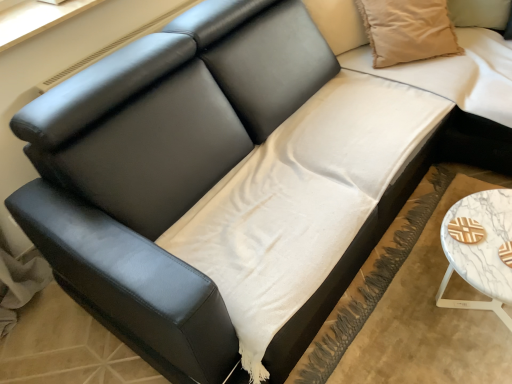
Question: Is beige cotton pillow at upper right far from white marble table at lower right?

Choices:
 (A) yes
 (B) no

Answer: (B)

Question: Is beige cotton pillow at upper right completely or partially outside of white marble table at lower right?

Choices:
 (A) yes
 (B) no

Answer: (A)

Question: Does beige cotton pillow at upper right have a greater height compared to white marble table at lower right?

Choices:
 (A) no
 (B) yes

Answer: (B)

Question: From a real-world perspective, is beige cotton pillow at upper right over white marble table at lower right?

Choices:
 (A) yes
 (B) no

Answer: (A)

Question: From the image's perspective, does beige cotton pillow at upper right appear higher than white marble table at lower right?

Choices:
 (A) yes
 (B) no

Answer: (A)

Question: Is beige cotton pillow at upper right thinner than white marble table at lower right?

Choices:
 (A) no
 (B) yes

Answer: (B)

Question: Is white marble table at lower right at the right side of white cotton sheet at center?

Choices:
 (A) no
 (B) yes

Answer: (B)

Question: From a real-world perspective, does white marble table at lower right stand above white cotton sheet at center?

Choices:
 (A) yes
 (B) no

Answer: (A)

Question: From the image's perspective, is white marble table at lower right on white cotton sheet at center?

Choices:
 (A) yes
 (B) no

Answer: (A)

Question: Would you say white marble table at lower right is a long distance from white cotton sheet at center?

Choices:
 (A) no
 (B) yes

Answer: (A)

Question: Does white marble table at lower right have a lesser height compared to white cotton sheet at center?

Choices:
 (A) yes
 (B) no

Answer: (B)

Question: Can we say white marble table at lower right lies outside white cotton sheet at center?

Choices:
 (A) no
 (B) yes

Answer: (B)

Question: Is white marble table at lower right positioned beyond the bounds of beige cotton pillow at upper right?

Choices:
 (A) yes
 (B) no

Answer: (A)